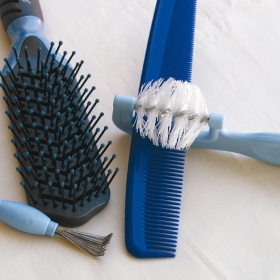
Identify the location of plastic hair brush. This screenshot has height=280, width=280. coord(64,164).